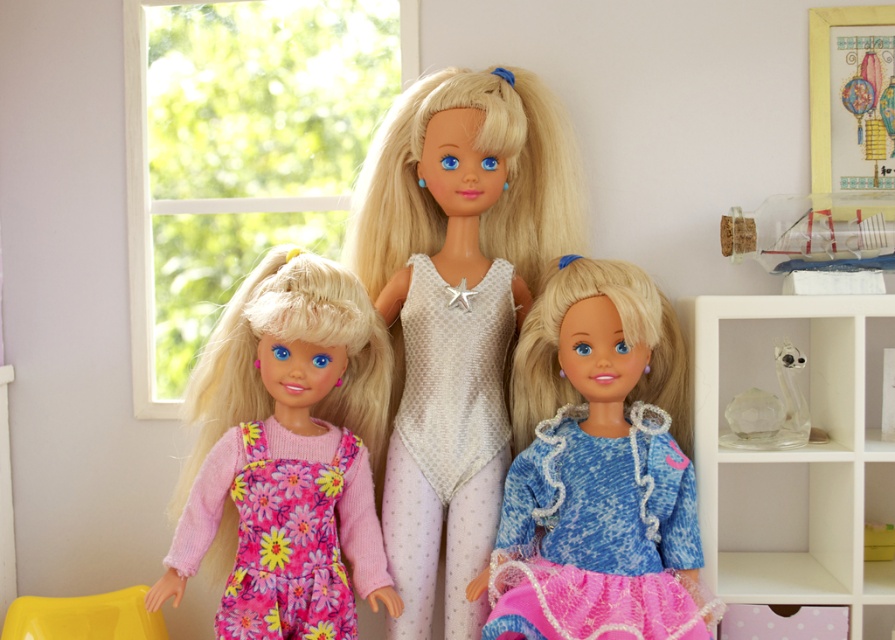
Is white dotted fabric dress at center shorter than fluffy pink fabric dress at left?

No.

Does point (441, 499) come farther from viewer compared to point (334, 385)?

No.

Who is more forward, (x=419, y=332) or (x=307, y=422)?

Point (x=307, y=422) is in front.

The image size is (895, 640). What are the coordinates of `white dotted fabric dress at center` in the screenshot? It's located at (456, 312).

Is point (313, 314) farther from camera compared to point (210, 522)?

No, (313, 314) is in front of (210, 522).

Is point (231, 356) farther from viewer compared to point (276, 440)?

Yes.

This screenshot has height=640, width=895. I want to click on fluffy pink fabric dress at left, so click(287, 452).

Between white dotted fabric dress at center and floral fabric dress at lower left, which one is positioned lower?

floral fabric dress at lower left is lower down.

This screenshot has height=640, width=895. Describe the element at coordinates (456, 312) in the screenshot. I see `white dotted fabric dress at center` at that location.

Locate an element on the screen. Image resolution: width=895 pixels, height=640 pixels. white dotted fabric dress at center is located at coordinates (456, 312).